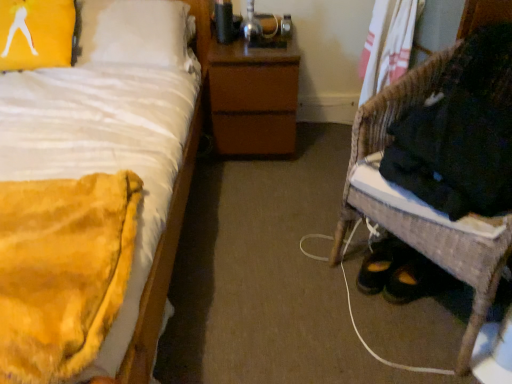
At what (x,y) coordinates should I click in order to perform the action: click on free space in front of brown matte nightstand at center. Please return your answer as a coordinate pair (x, y). This screenshot has width=512, height=384. Looking at the image, I should click on (263, 181).